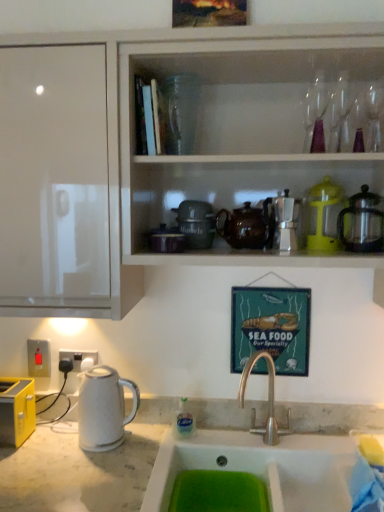
Question: Is white glossy cabinet at upper center further to the viewer compared to metallic signboard at center?

Choices:
 (A) yes
 (B) no

Answer: (B)

Question: Does white glossy cabinet at upper center have a lesser height compared to metallic signboard at center?

Choices:
 (A) no
 (B) yes

Answer: (A)

Question: Is metallic signboard at center completely or partially inside white glossy cabinet at upper center?

Choices:
 (A) no
 (B) yes

Answer: (A)

Question: Can you confirm if white glossy cabinet at upper center is bigger than metallic signboard at center?

Choices:
 (A) no
 (B) yes

Answer: (B)

Question: From a real-world perspective, is white glossy cabinet at upper center beneath metallic signboard at center?

Choices:
 (A) yes
 (B) no

Answer: (B)

Question: Considering their positions, is satin silver coffee pot at upper right, acting as the 1th appliance starting from the right, located in front of or behind red plastic switch at lower left, placed as the first electric outlet when sorted from left to right?

Choices:
 (A) front
 (B) behind

Answer: (A)

Question: From a real-world perspective, is satin silver coffee pot at upper right, which is the 3th appliance in left-to-right order, above or below red plastic switch at lower left, placed as the first electric outlet when sorted from left to right?

Choices:
 (A) below
 (B) above

Answer: (B)

Question: Considering the positions of satin silver coffee pot at upper right, acting as the 1th appliance starting from the right, and red plastic switch at lower left, placed as the first electric outlet when sorted from left to right, in the image, is satin silver coffee pot at upper right, acting as the 1th appliance starting from the right, taller or shorter than red plastic switch at lower left, placed as the first electric outlet when sorted from left to right,?

Choices:
 (A) tall
 (B) short

Answer: (A)

Question: Does point (362, 242) appear closer or farther from the camera than point (39, 369)?

Choices:
 (A) farther
 (B) closer

Answer: (B)

Question: Considering the positions of metallic signboard at center and red plastic switch at lower left, placed as the first electric outlet when sorted from left to right, in the image, is metallic signboard at center bigger or smaller than red plastic switch at lower left, placed as the first electric outlet when sorted from left to right,?

Choices:
 (A) big
 (B) small

Answer: (A)

Question: Is metallic signboard at center wider or thinner than red plastic switch at lower left, placed as the first electric outlet when sorted from left to right?

Choices:
 (A) wide
 (B) thin

Answer: (B)

Question: Does point (304, 337) appear closer or farther from the camera than point (34, 359)?

Choices:
 (A) closer
 (B) farther

Answer: (A)

Question: Choose the correct answer: Is metallic signboard at center inside red plastic switch at lower left, which is counted as the 2th electric outlet, starting from the right, or outside it?

Choices:
 (A) outside
 (B) inside

Answer: (A)

Question: Is point (74, 364) positioned closer to the camera than point (135, 261)?

Choices:
 (A) farther
 (B) closer

Answer: (A)

Question: From their relative heights in the image, would you say white plastic electric outlet at lower left, which is the second electric outlet from left to right, is taller or shorter than white glossy cabinet at upper center?

Choices:
 (A) short
 (B) tall

Answer: (A)